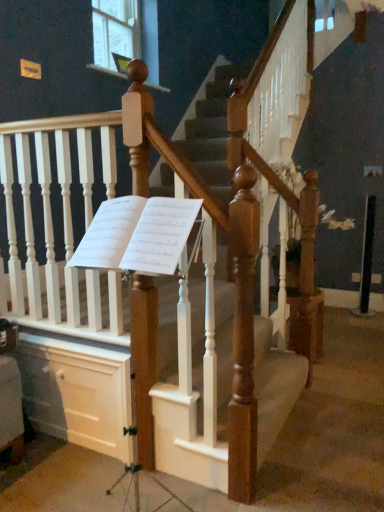
This screenshot has width=384, height=512. What are the coordinates of `free space in front of white painted wood drawer at lower left` in the screenshot? It's located at (55, 476).